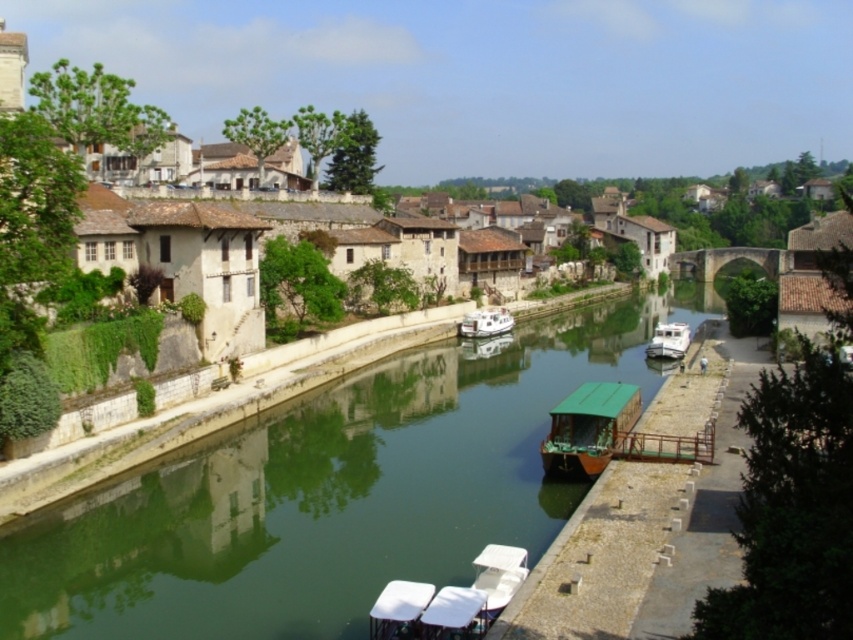
Who is more forward, (405, 451) or (457, 330)?

Point (405, 451) is in front.

Does green smooth water at center appear on the left side of white glossy houseboat at center?

Incorrect, green smooth water at center is not on the left side of white glossy houseboat at center.

Where is `green smooth water at center`? This screenshot has width=853, height=640. green smooth water at center is located at coordinates (332, 492).

Which is behind, point (578, 426) or point (662, 342)?

Positioned behind is point (662, 342).

Describe the element at coordinates (589, 428) in the screenshot. I see `green matte boat at center` at that location.

What are the coordinates of `green matte boat at center` in the screenshot? It's located at (589, 428).

Is green smooth water at center thinner than white matte boat at center-right?

No, green smooth water at center is not thinner than white matte boat at center-right.

Can you confirm if green smooth water at center is bigger than white matte boat at center-right?

Indeed, green smooth water at center has a larger size compared to white matte boat at center-right.

The image size is (853, 640). What do you see at coordinates (332, 492) in the screenshot? I see `green smooth water at center` at bounding box center [332, 492].

Where is `green smooth water at center`? The width and height of the screenshot is (853, 640). green smooth water at center is located at coordinates (332, 492).